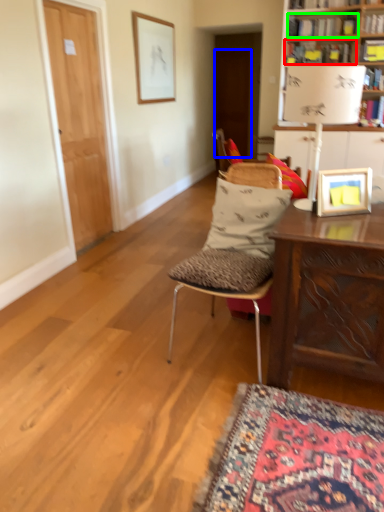
Question: Which is farther away from book (highlighted by a red box)? door (highlighted by a blue box) or book (highlighted by a green box)?

Choices:
 (A) door
 (B) book

Answer: (A)